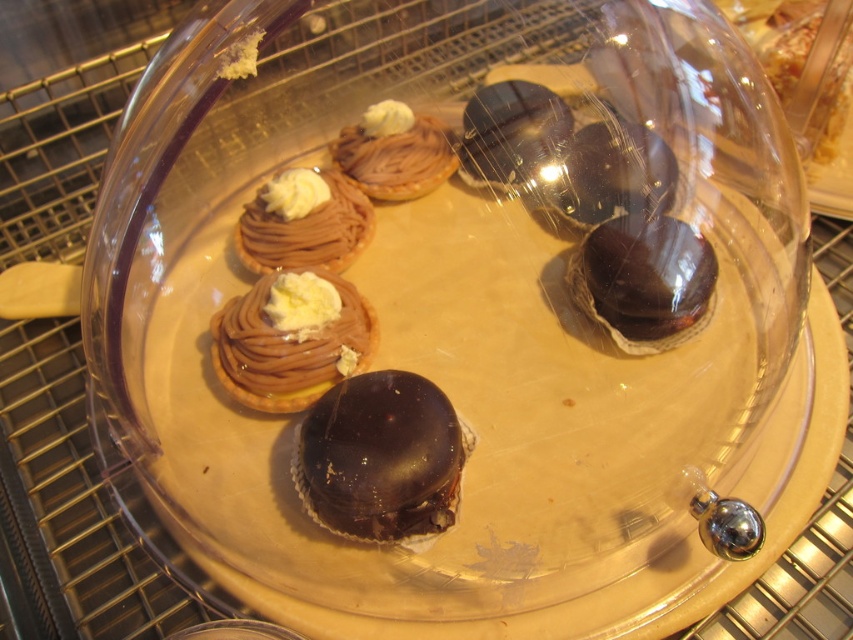
Question: Which point is farther to the camera?

Choices:
 (A) (614, 163)
 (B) (512, 141)
 (C) (454, 141)
 (D) (392, 477)

Answer: (C)

Question: Does shiny chocolate truffle at center have a larger size compared to chocolate cream tart at upper left?

Choices:
 (A) yes
 (B) no

Answer: (B)

Question: Which of the following is the closest to the observer?

Choices:
 (A) shiny chocolate truffle at upper center
 (B) chocolate cream tart at upper left

Answer: (A)

Question: In this image, where is chocolate cream tart at center located relative to shiny chocolate truffle at center?

Choices:
 (A) above
 (B) below

Answer: (B)

Question: Among these points, which one is farthest from the camera?

Choices:
 (A) (259, 344)
 (B) (685, 326)
 (C) (335, 177)

Answer: (B)

Question: Observing the image, what is the correct spatial positioning of shiny chocolate dome at center in reference to chocolate cream tartlet at upper center?

Choices:
 (A) above
 (B) below

Answer: (B)